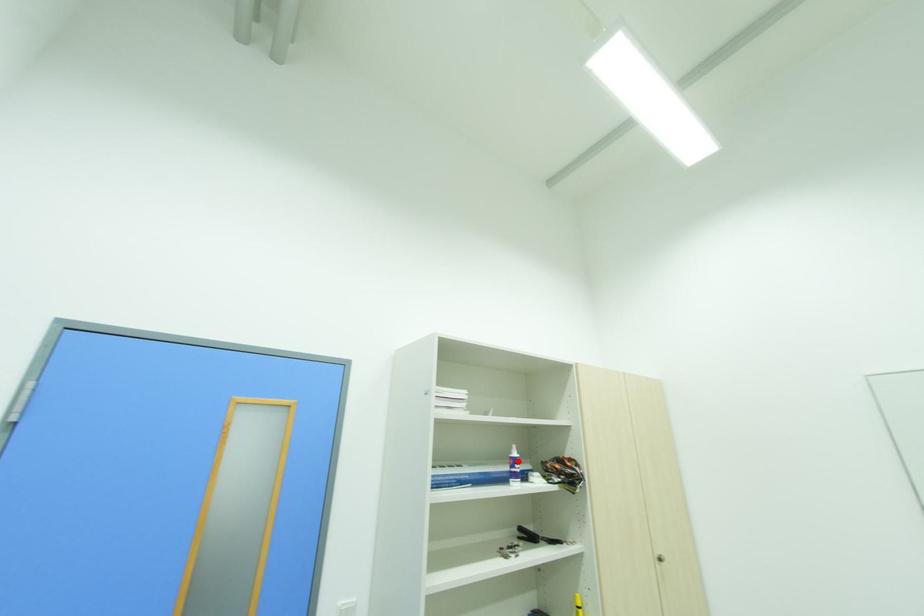
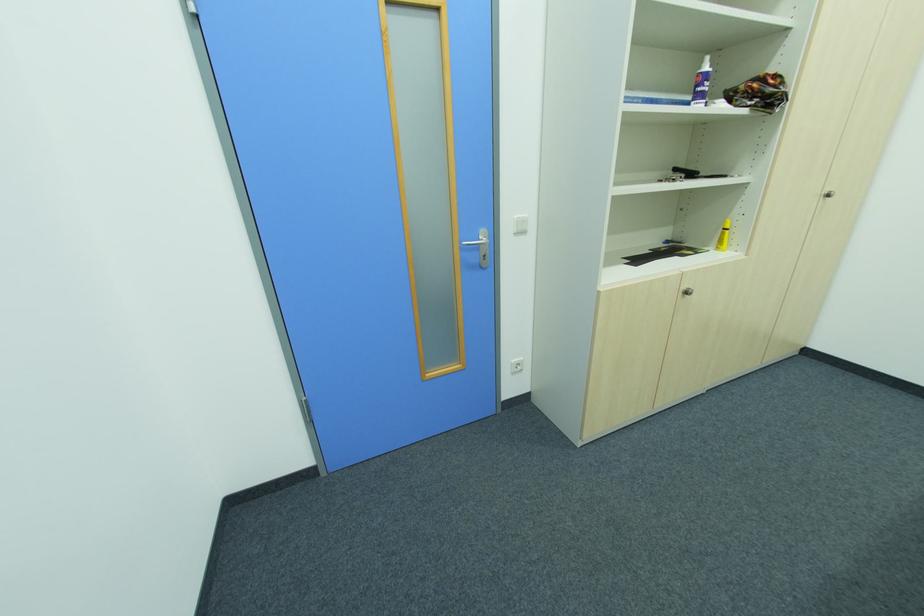
Locate, in the second image, the point that corresponds to the highlighted location in the first image.

(708, 78)